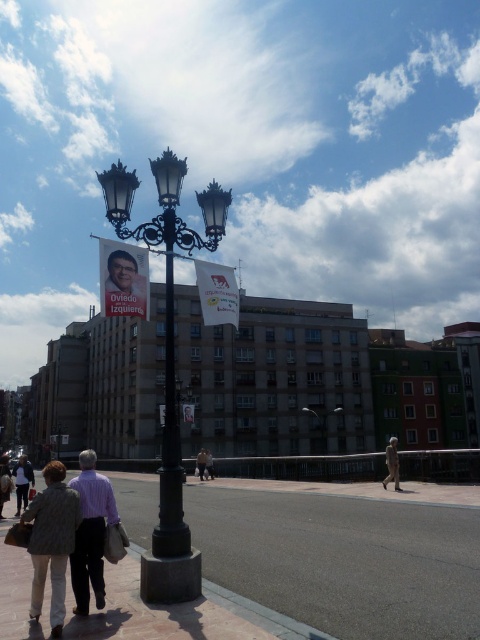
You are standing on the pedestrian walkway and see the brown leather jacket at center. If you walk straight ahead towards the multi story building complex, will the jacket be in your path?

The brown leather jacket at center is located at point (202, 461). Since it is at the center of the scene, walking straight towards the building complex would place the jacket directly in your path.

You are a photographer trying to capture the lamppost and the banners in the scene. You want to ensure that both points, point (x=200, y=468) and point (x=214, y=476), are in focus. Given that your camera can only focus on one point at a time, which point should you focus on to maximize the chances of both being sharp?

You should focus on point (x=214, y=476) because it is further away from the camera than point (x=200, y=468). By focusing on the farther point, the depth of field will include the closer point as well, increasing the likelihood of both being in focus.

You are a delivery person carrying a box that requires a clear path to the brown brick pavement at lower center. There is a person wearing a purple striped shirt at lower left in your way. Can you safely navigate around them without getting too close?

The brown brick pavement at lower center and purple striped shirt at lower left are 7.17 meters apart from each other. Since the distance is sufficient, you can safely navigate around the person wearing the purple striped shirt at lower left to reach the brown brick pavement at lower center without getting too close.